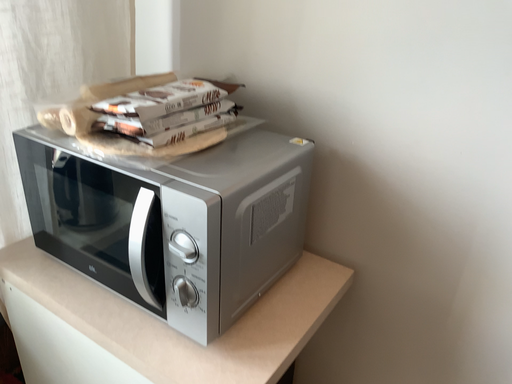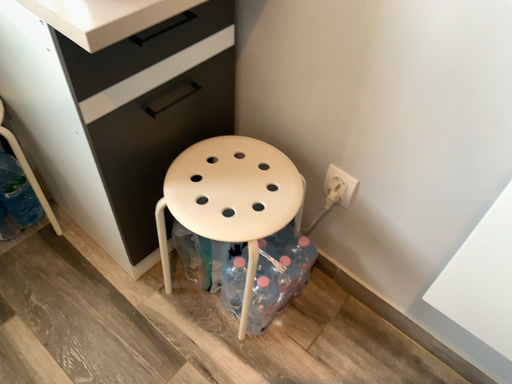
Question: How did the camera likely rotate when shooting the video?

Choices:
 (A) rotated right
 (B) rotated left

Answer: (B)